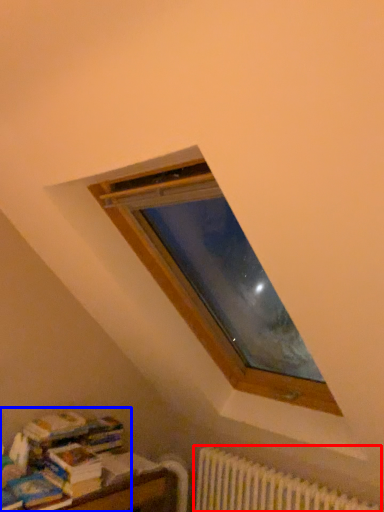
Question: Which point is further to the camera, radiator (highlighted by a red box) or book (highlighted by a blue box)?

Choices:
 (A) radiator
 (B) book

Answer: (B)